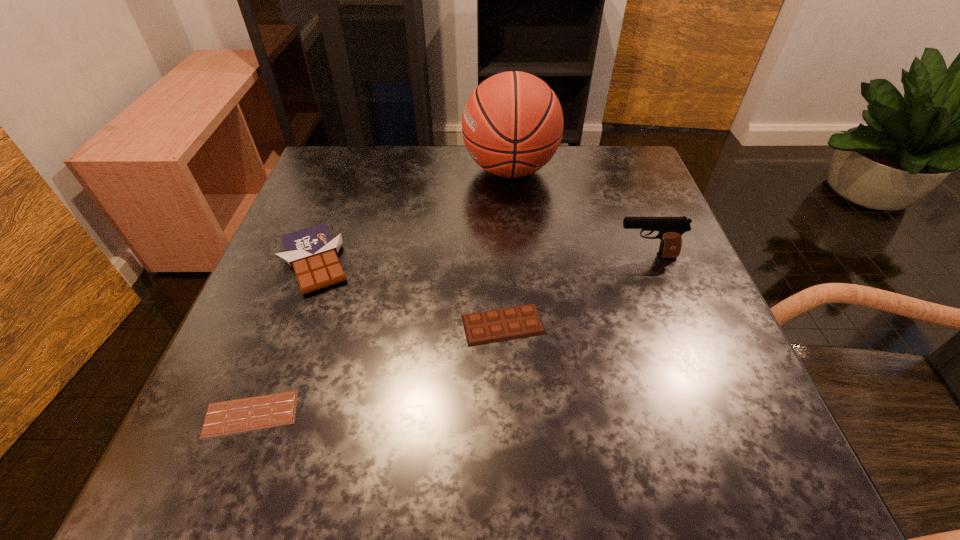
In the image, there is a desktop. Find the location of `free space at the near right corner`. free space at the near right corner is located at coordinates (753, 454).

This screenshot has height=540, width=960. Find the location of `vacant space in between the pistol and the nearest chocolate bar`. vacant space in between the pistol and the nearest chocolate bar is located at coordinates (448, 335).

I want to click on empty location between the pistol and the basketball, so click(x=578, y=213).

At what (x,y) coordinates should I click in order to perform the action: click on free space between the second tallest object and the shortest chocolate bar. Please return your answer as a coordinate pair (x, y). This screenshot has width=960, height=540. Looking at the image, I should click on (448, 335).

Where is `free space between the farthest chocolate bar and the fourth shortest object`? The width and height of the screenshot is (960, 540). free space between the farthest chocolate bar and the fourth shortest object is located at coordinates (480, 259).

Where is `vacant area that lies between the shortest object and the tallest chocolate bar`? vacant area that lies between the shortest object and the tallest chocolate bar is located at coordinates (283, 338).

Image resolution: width=960 pixels, height=540 pixels. What are the coordinates of `vacant area that lies between the tallest chocolate bar and the second shortest object` in the screenshot? It's located at (409, 293).

This screenshot has width=960, height=540. I want to click on blank region between the fourth shortest object and the farthest chocolate bar, so click(x=480, y=259).

The height and width of the screenshot is (540, 960). I want to click on empty space between the farthest object and the shortest object, so click(x=380, y=292).

Identify the location of unoccupied position between the shortest chocolate bar and the pistol. (448, 335).